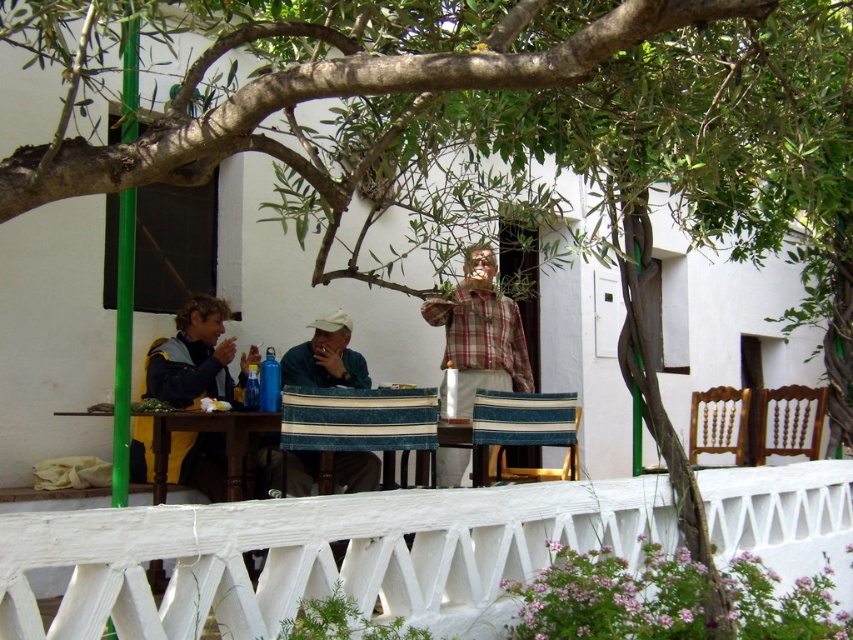
Between white painted wood at lower center and matte beige cap at center, which one is positioned lower?

Positioned lower is white painted wood at lower center.

Identify the location of white painted wood at lower center. The image size is (853, 640). (316, 556).

Does matte blue water bottle at center appear under matte beige cap at center?

No.

Does matte blue water bottle at center have a smaller size compared to matte beige cap at center?

No.

This screenshot has height=640, width=853. Find the location of `matte blue water bottle at center`. matte blue water bottle at center is located at coordinates (480, 333).

Is plaid fabric shirt at center closer to the viewer compared to matte beige cap at center?

No, it is not.

Between plaid fabric shirt at center and matte beige cap at center, which one has more height?

Standing taller between the two is plaid fabric shirt at center.

Identify the location of plaid fabric shirt at center. This screenshot has width=853, height=640. (480, 332).